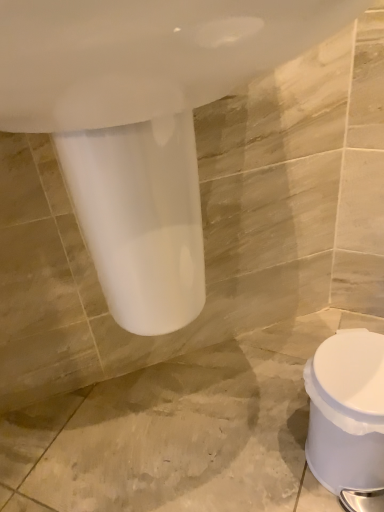
Question: Is white glossy sink at upper center oriented away from white plastic toilet at lower right?

Choices:
 (A) no
 (B) yes

Answer: (A)

Question: From the image's perspective, is white glossy sink at upper center under white plastic toilet at lower right?

Choices:
 (A) no
 (B) yes

Answer: (A)

Question: Does white glossy sink at upper center have a greater height compared to white plastic toilet at lower right?

Choices:
 (A) yes
 (B) no

Answer: (A)

Question: Considering the relative positions of white glossy sink at upper center and white plastic toilet at lower right in the image provided, is white glossy sink at upper center behind white plastic toilet at lower right?

Choices:
 (A) no
 (B) yes

Answer: (A)

Question: Is white glossy sink at upper center bigger than white plastic toilet at lower right?

Choices:
 (A) yes
 (B) no

Answer: (A)

Question: Can you confirm if white glossy sink at upper center is shorter than white plastic toilet at lower right?

Choices:
 (A) no
 (B) yes

Answer: (A)

Question: Is white plastic toilet at lower right looking in the opposite direction of white glossy sink at upper center?

Choices:
 (A) no
 (B) yes

Answer: (A)

Question: Is white plastic toilet at lower right bigger than white glossy sink at upper center?

Choices:
 (A) yes
 (B) no

Answer: (B)

Question: Is white glossy sink at upper center a part of white plastic toilet at lower right?

Choices:
 (A) yes
 (B) no

Answer: (B)

Question: Is white plastic toilet at lower right behind white glossy sink at upper center?

Choices:
 (A) yes
 (B) no

Answer: (A)

Question: Is white plastic toilet at lower right with white glossy sink at upper center?

Choices:
 (A) no
 (B) yes

Answer: (A)

Question: Is white plastic toilet at lower right closer to the viewer compared to white glossy sink at upper center?

Choices:
 (A) yes
 (B) no

Answer: (B)

Question: Considering their positions, is white plastic toilet at lower right located in front of or behind white glossy sink at upper center?

Choices:
 (A) front
 (B) behind

Answer: (B)